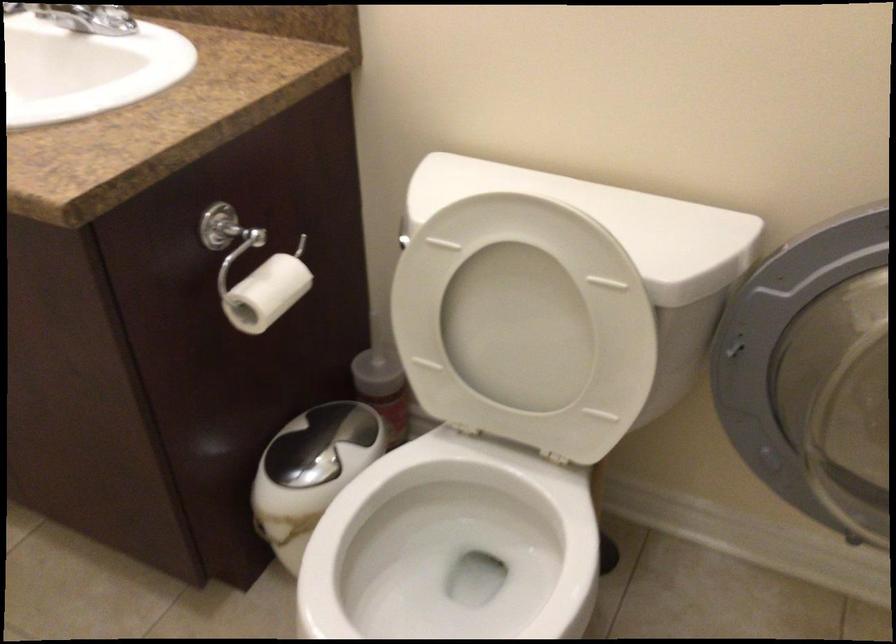
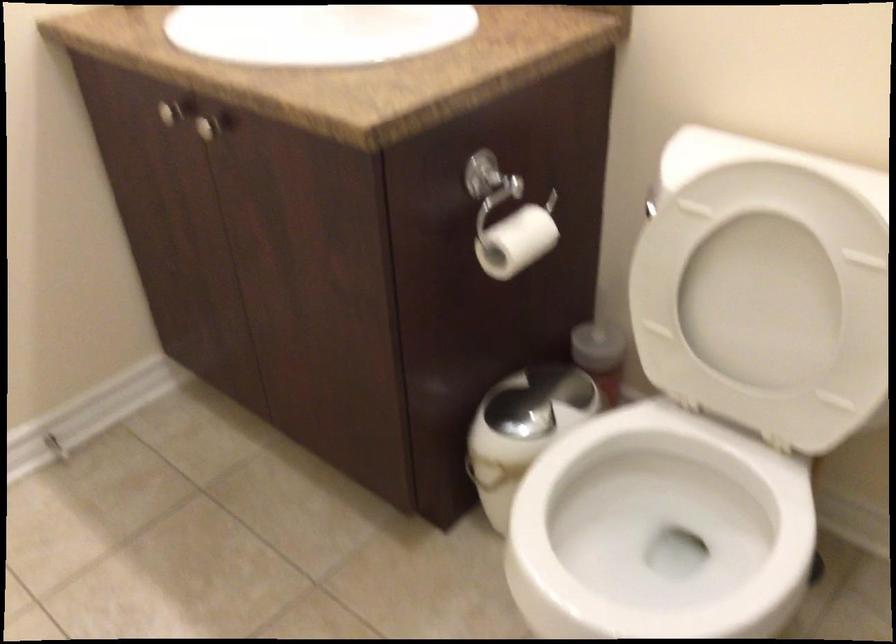
In the second image, find the point that corresponds to point (462, 556) in the first image.

(660, 524)